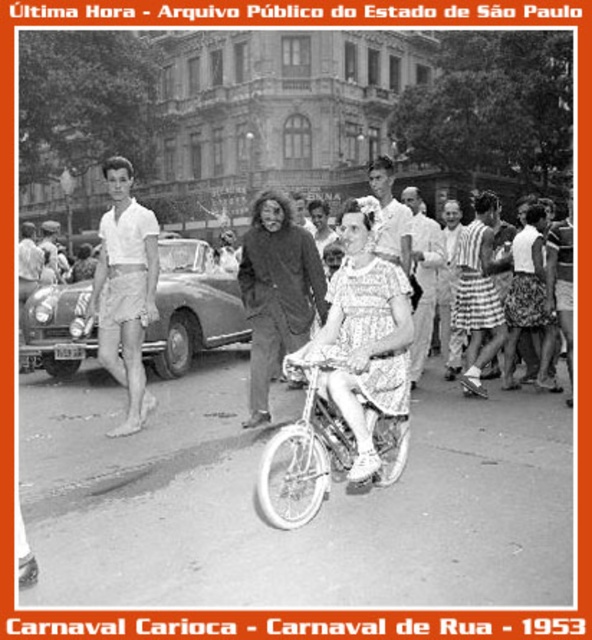
Does white cotton shorts at left appear on the right side of smooth white shirt at center?

No, white cotton shorts at left is not to the right of smooth white shirt at center.

Measure the distance between white cotton shorts at left and smooth white shirt at center.

white cotton shorts at left and smooth white shirt at center are 14.59 meters apart.

Find the location of `white cotton shorts at left`. white cotton shorts at left is located at coordinates (124, 291).

Who is more distant from viewer, (139, 246) or (300, 490)?

The point (139, 246) is more distant.

Can you confirm if white cotton shorts at left is taller than white matte bicycle at center?

Yes.

Is point (139, 221) behind point (262, 472)?

Yes, it is behind point (262, 472).

Where is `white cotton shorts at left`? The width and height of the screenshot is (592, 640). white cotton shorts at left is located at coordinates (124, 291).

Does dark brown wool coat at center have a greater height compared to smooth white shirt at center?

Yes, dark brown wool coat at center is taller than smooth white shirt at center.

Which of these two, dark brown wool coat at center or smooth white shirt at center, stands shorter?

Standing shorter between the two is smooth white shirt at center.

Is point (268, 342) positioned after point (385, 227)?

That is False.

The height and width of the screenshot is (640, 592). I want to click on dark brown wool coat at center, so click(276, 292).